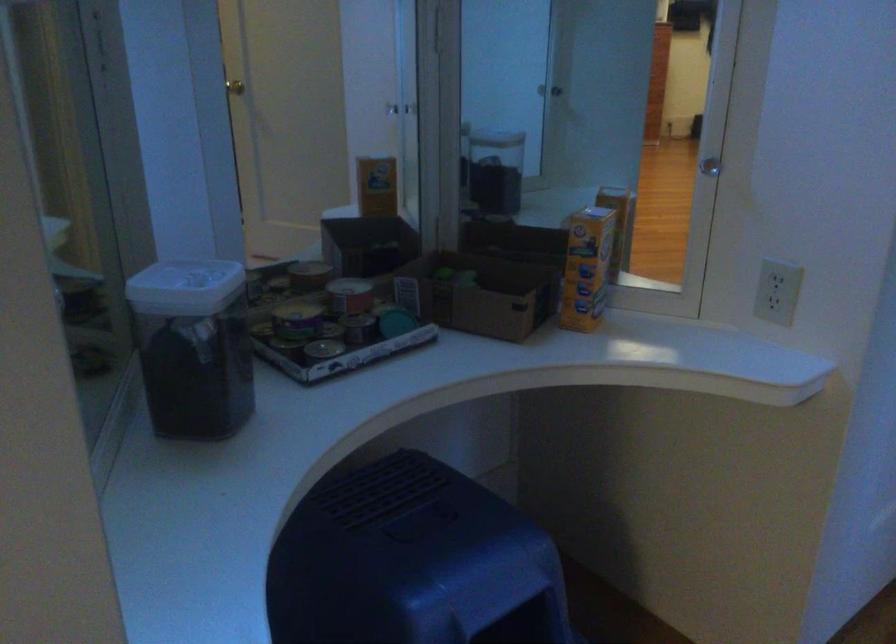
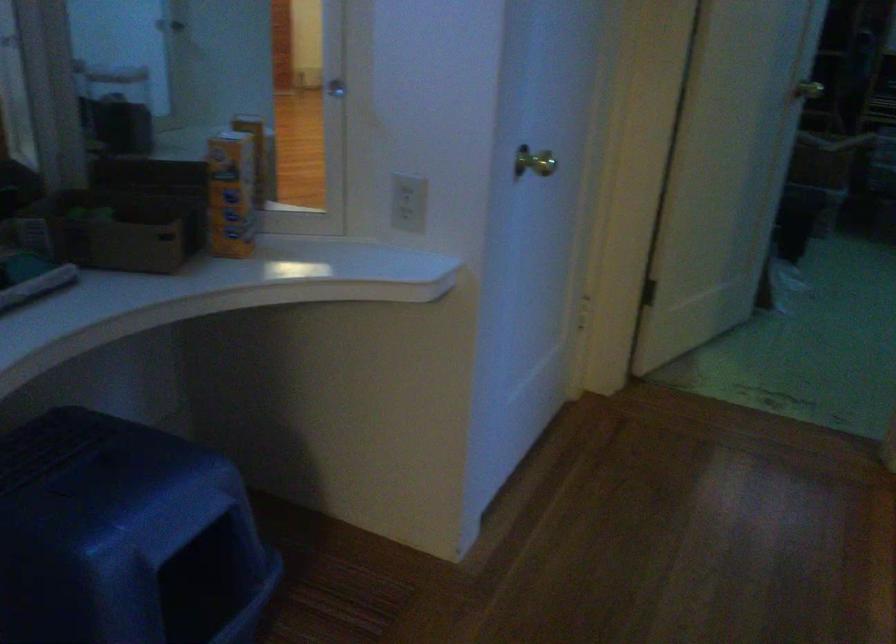
Where in the second image is the point corresponding to the point at 586,269 from the first image?

(230, 194)